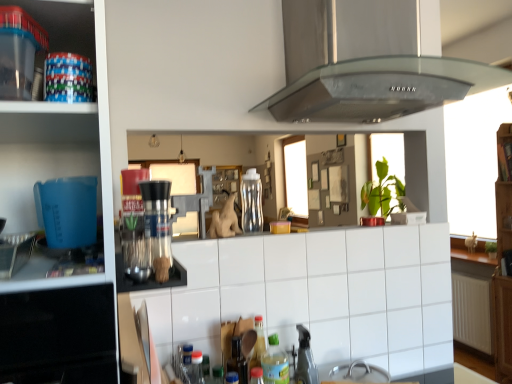
Question: Is transparent plastic containers at upper left positioned behind wooden shelf at upper right?

Choices:
 (A) yes
 (B) no

Answer: (B)

Question: Is transparent plastic containers at upper left oriented towards wooden shelf at upper right?

Choices:
 (A) yes
 (B) no

Answer: (B)

Question: Considering the relative sizes of transparent plastic containers at upper left and wooden shelf at upper right in the image provided, is transparent plastic containers at upper left shorter than wooden shelf at upper right?

Choices:
 (A) yes
 (B) no

Answer: (A)

Question: Considering the relative sizes of transparent plastic containers at upper left and wooden shelf at upper right in the image provided, is transparent plastic containers at upper left smaller than wooden shelf at upper right?

Choices:
 (A) no
 (B) yes

Answer: (A)

Question: Is transparent plastic containers at upper left in front of wooden shelf at upper right?

Choices:
 (A) no
 (B) yes

Answer: (B)

Question: Can you confirm if transparent plastic containers at upper left is bigger than wooden shelf at upper right?

Choices:
 (A) yes
 (B) no

Answer: (A)

Question: Is transparent plastic containers at upper left not within stainless steel range hood at upper center?

Choices:
 (A) yes
 (B) no

Answer: (A)

Question: Can you confirm if transparent plastic containers at upper left is smaller than stainless steel range hood at upper center?

Choices:
 (A) yes
 (B) no

Answer: (A)

Question: Can you confirm if transparent plastic containers at upper left is taller than stainless steel range hood at upper center?

Choices:
 (A) yes
 (B) no

Answer: (B)

Question: Could you tell me if transparent plastic containers at upper left is facing stainless steel range hood at upper center?

Choices:
 (A) yes
 (B) no

Answer: (B)

Question: Can you confirm if transparent plastic containers at upper left is positioned to the left of stainless steel range hood at upper center?

Choices:
 (A) no
 (B) yes

Answer: (B)

Question: Considering the relative positions of transparent plastic containers at upper left and stainless steel range hood at upper center in the image provided, is transparent plastic containers at upper left in front of stainless steel range hood at upper center?

Choices:
 (A) no
 (B) yes

Answer: (B)

Question: From the image's perspective, is white tile at center located above satin silver coffee machine at center?

Choices:
 (A) yes
 (B) no

Answer: (B)